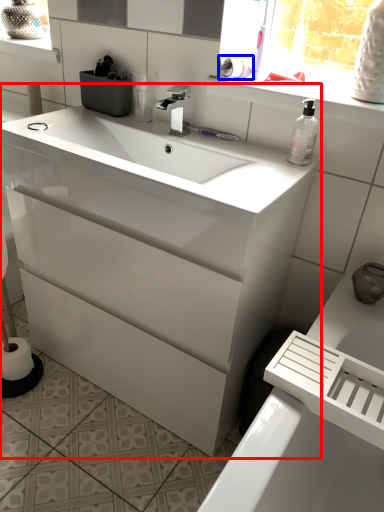
Question: Which point is further to the camera, bathroom cabinet (highlighted by a red box) or toilet paper (highlighted by a blue box)?

Choices:
 (A) bathroom cabinet
 (B) toilet paper

Answer: (B)